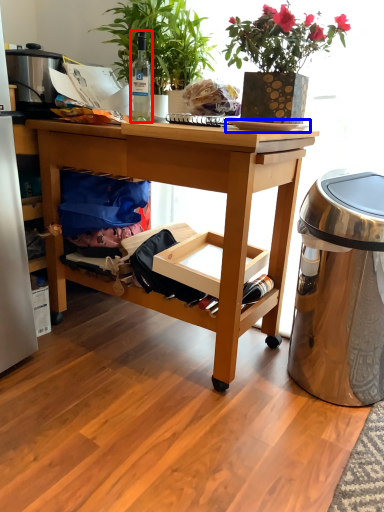
Question: Which object is further to the camera taking this photo, bottle (highlighted by a red box) or plate (highlighted by a blue box)?

Choices:
 (A) bottle
 (B) plate

Answer: (A)